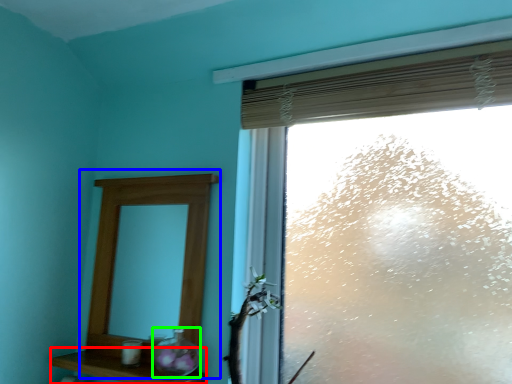
Question: Which object is the farthest from shelf (highlighted by a red box)? Choose among these: medicine cabinet (highlighted by a blue box) or glass vase (highlighted by a green box).

Choices:
 (A) medicine cabinet
 (B) glass vase

Answer: (A)